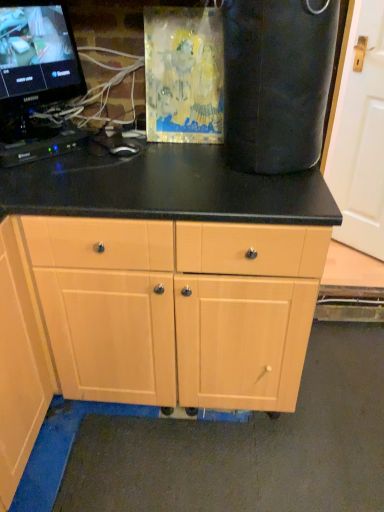
In order to click on vacant area on top of black plastic keyboard at left (from a real-world perspective) in this screenshot , I will do `click(36, 136)`.